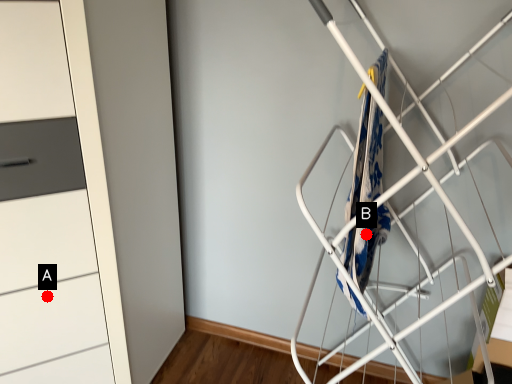
Question: Two points are circled on the image, labeled by A and B beside each circle. Which point appears farthest from the camera in this image?

Choices:
 (A) A is further
 (B) B is further

Answer: (A)